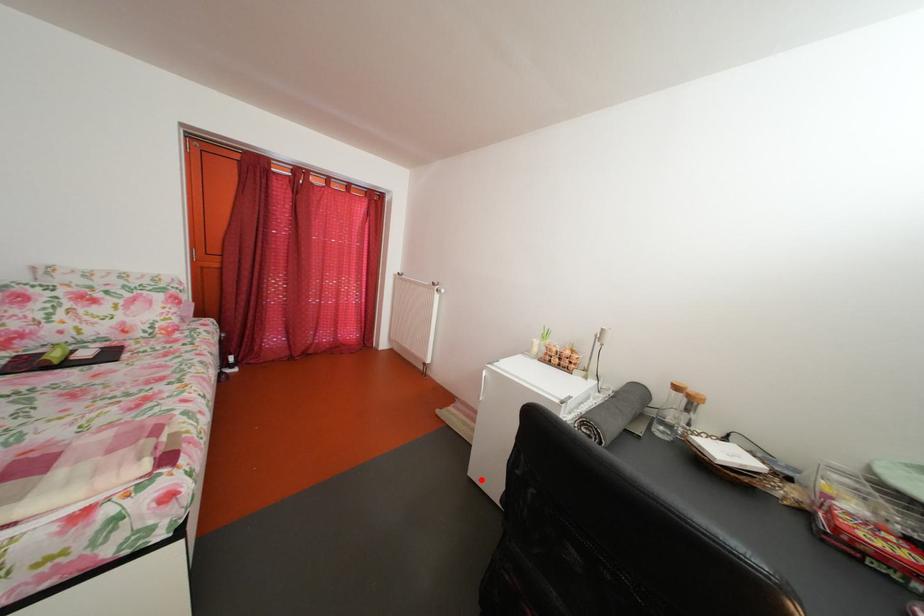
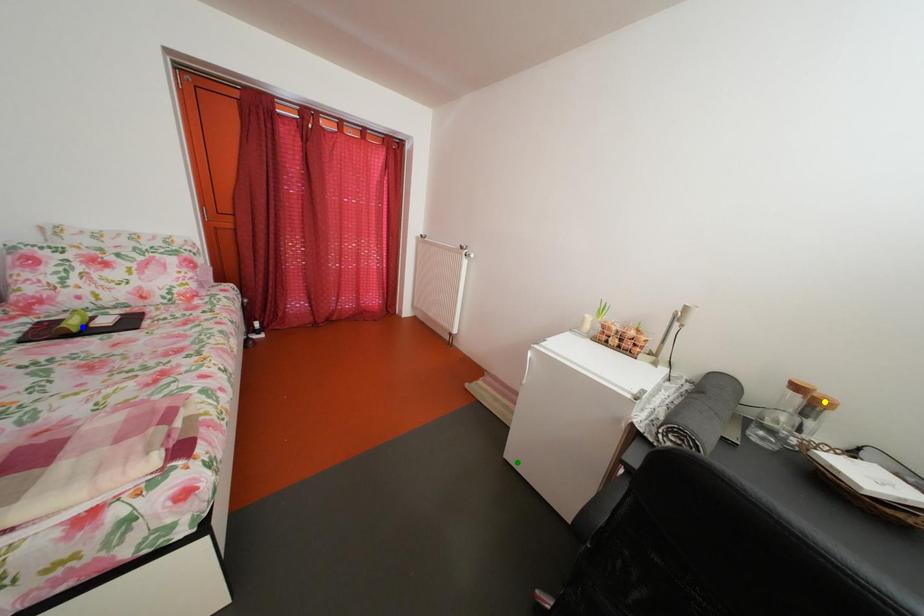
Question: I am providing you with two images of the same scene from different viewpoints. A red point is marked on the first image. You are given multiple points on the second image. Which spot in image 2 lines up with the point in image 1?

Choices:
 (A) yellow point
 (B) blue point
 (C) green point

Answer: (C)